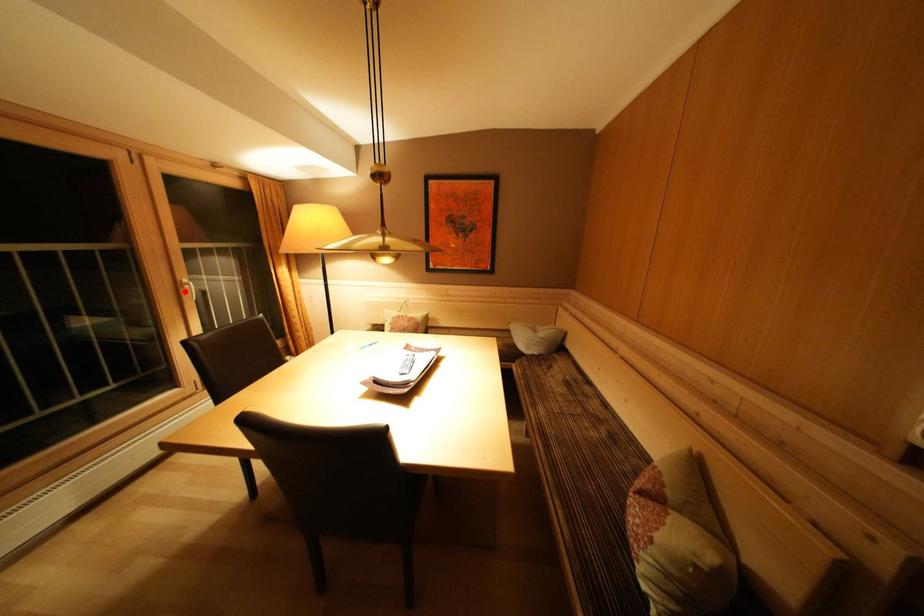
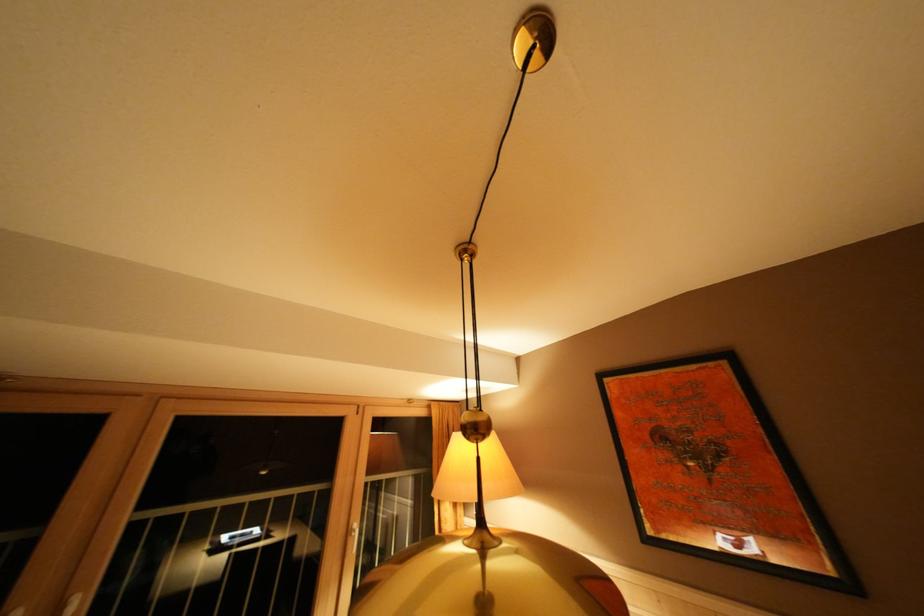
Where in the second image is the point corresponding to the highlighted location from the first image?

(355, 537)